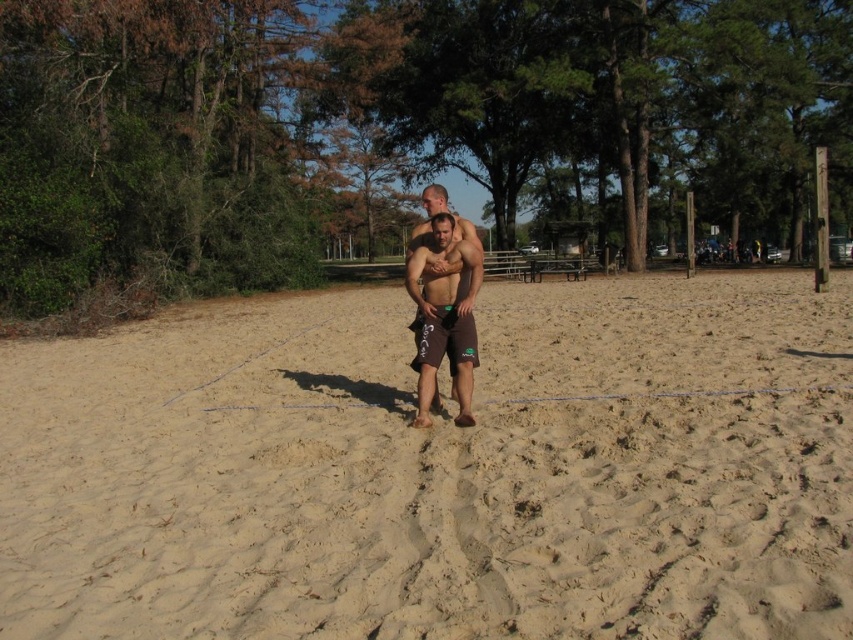
Question: Does beige sandy beach at center appear on the left side of brown matte shorts at center?

Choices:
 (A) no
 (B) yes

Answer: (A)

Question: Which point appears closest to the camera in this image?

Choices:
 (A) (502, 525)
 (B) (426, 211)

Answer: (A)

Question: Is beige sandy beach at center to the right of brown matte shorts at center from the viewer's perspective?

Choices:
 (A) yes
 (B) no

Answer: (A)

Question: Is the position of beige sandy beach at center less distant than that of brown matte shorts at center?

Choices:
 (A) yes
 (B) no

Answer: (A)

Question: Which object is farther from the camera taking this photo?

Choices:
 (A) brown matte shorts at center
 (B) beige sandy beach at center

Answer: (A)

Question: Which of the following is the closest to the observer?

Choices:
 (A) (474, 246)
 (B) (553, 372)

Answer: (A)